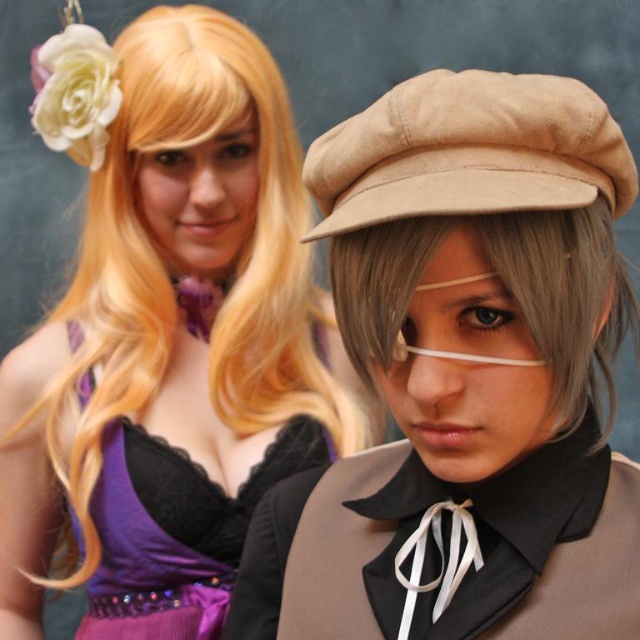
You are a photographer setting up for a photoshoot. You need to ensure that both the matte blonde wig at upper left and the gray matte wig at center are visible in the frame. Based on their positions, which wig might partially block the other?

The gray matte wig at center is behind the matte blonde wig at upper left, so it might be partially blocked by the matte blonde wig at upper left.

You are a photographer setting up for a photoshoot with two cosplayers. You need to ensure that the distance between the matte blonde wig at upper left and the other cosplayer is exactly 40 inches for proper lighting. Based on the current setup, is the distance sufficient?

The matte blonde wig at upper left and the other cosplayer are currently 38.96 inches apart, which is slightly less than the required 40 inches. To achieve the desired distance, they should move about 1.04 inches farther apart.

You are a photographer setting up a shoot with two models wearing the suede beige beret at center and the gray matte wig at center. You need to ensure there is at least 2 inches of space between their heads for proper lighting. Based on the current positioning, will the required space be met?

The suede beige beret at center is 1.74 inches from the gray matte wig at center, which is less than the required 2 inches. Therefore, the space between their heads is insufficient for proper lighting.